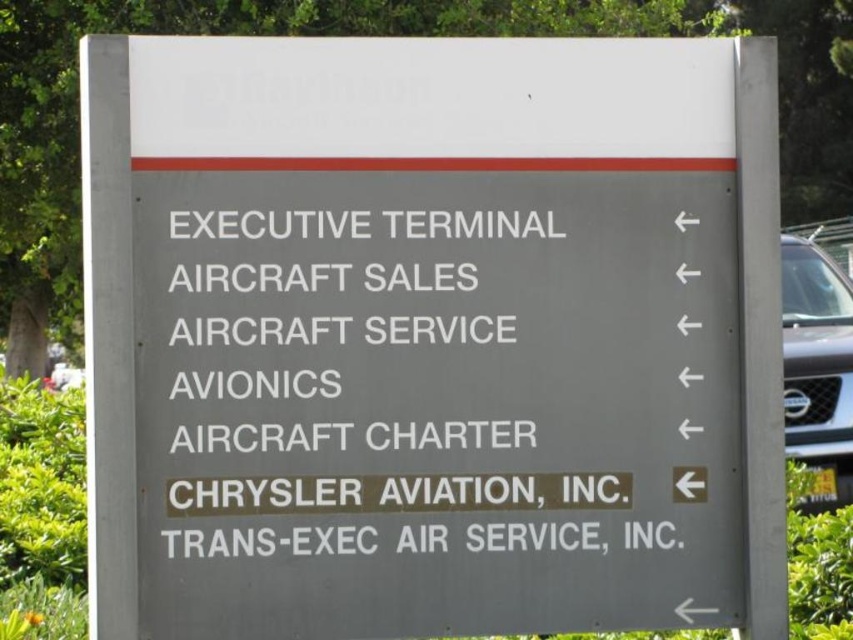
Who is more forward, (581, 416) or (837, 451)?

Point (581, 416) is more forward.

Consider the image. Which is above, white text on gray sign at center or satin silver suv at right?

white text on gray sign at center is higher up.

Who is more distant from viewer, (473,404) or (801,392)?

Point (801,392)

This screenshot has height=640, width=853. Find the location of `white text on gray sign at center`. white text on gray sign at center is located at coordinates (402, 388).